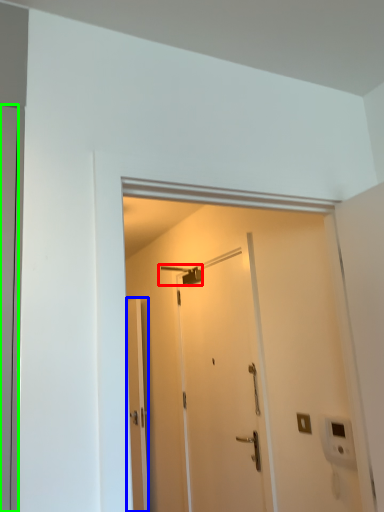
Question: Which object is positioned closest to shower (highlighted by a red box)? Select from door (highlighted by a blue box) and door (highlighted by a green box).

Choices:
 (A) door
 (B) door

Answer: (A)